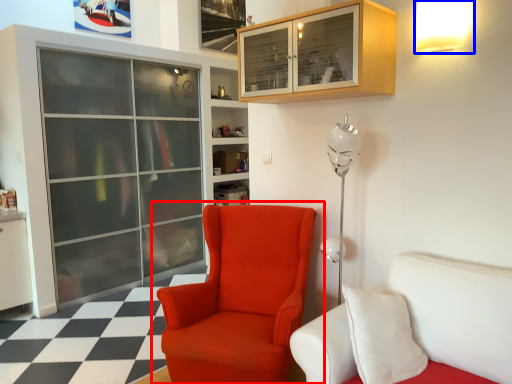
Question: Which point is closer to the camera, chair (highlighted by a red box) or light fixture (highlighted by a blue box)?

Choices:
 (A) chair
 (B) light fixture

Answer: (A)